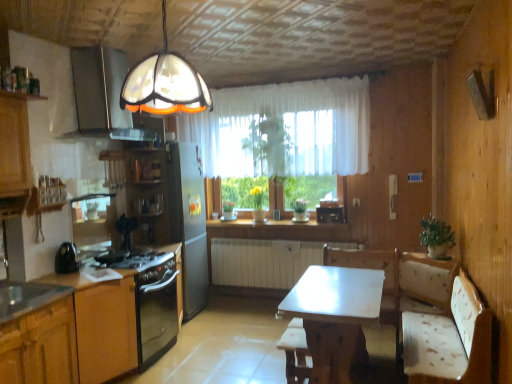
Find the location of a particular element. free space above wooden cabinet at left, arranged as the 2th cabinetry when viewed from the front (from a real-world perspective) is located at coordinates (87, 273).